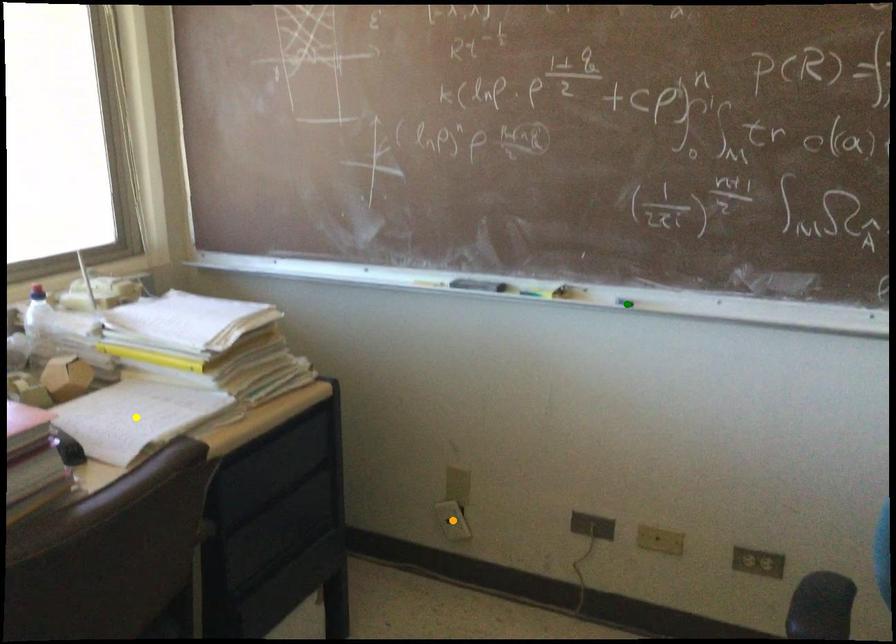
Order these from farthest to nearest:
yellow point, green point, orange point

orange point → green point → yellow point